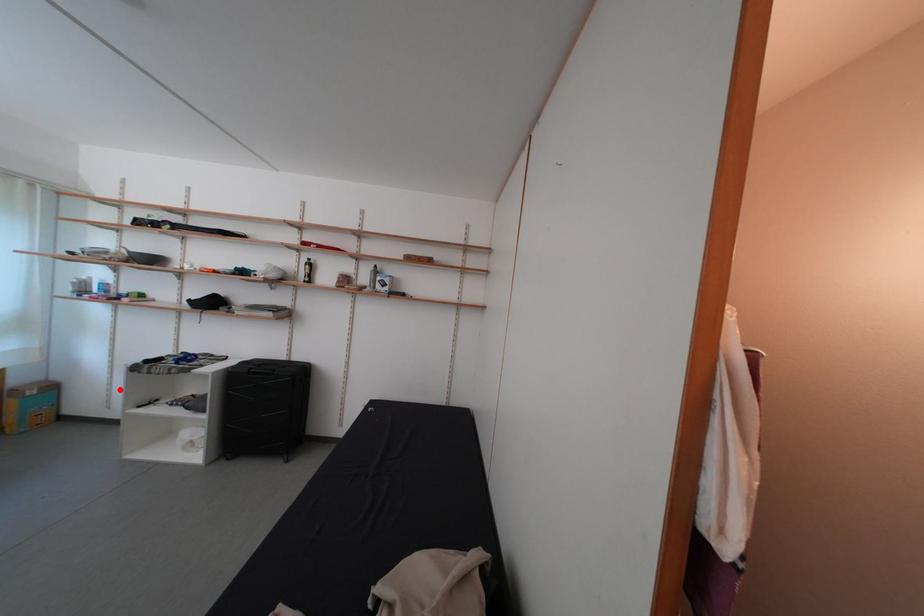
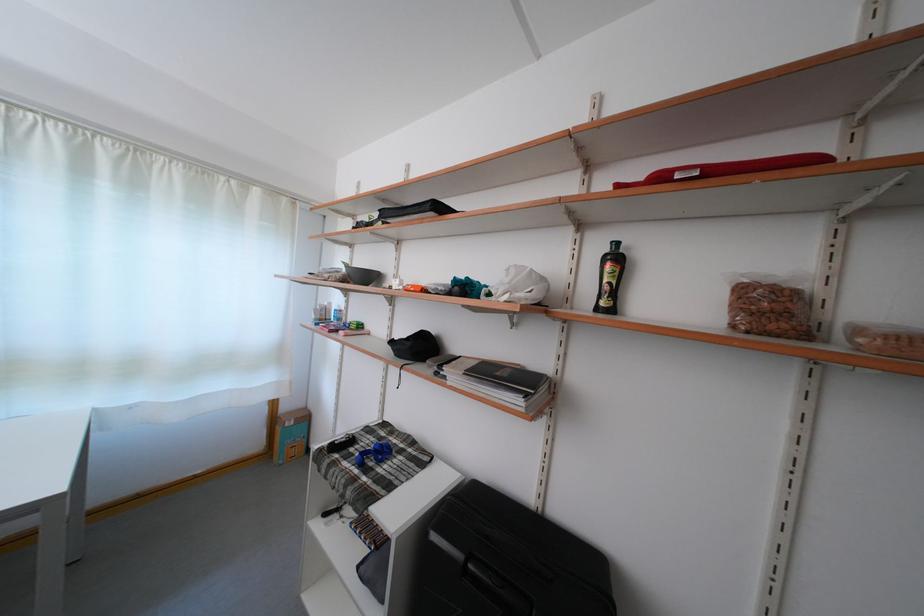
Question: I am providing you with two images of the same scene from different viewpoints. A red point is marked on the first image. Can you still see the location of the red point in image 2?

Choices:
 (A) Yes
 (B) No

Answer: (A)